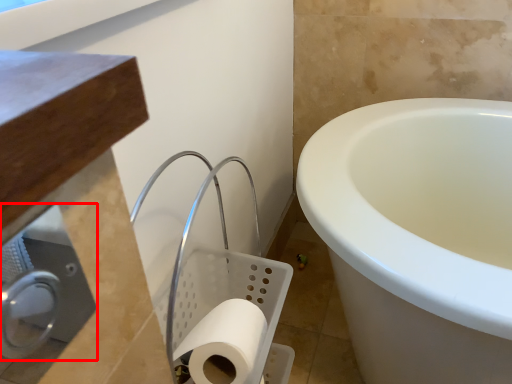
Question: From the image's perspective, where is dispenser (annotated by the red box) located relative to toilet paper?

Choices:
 (A) above
 (B) below

Answer: (A)